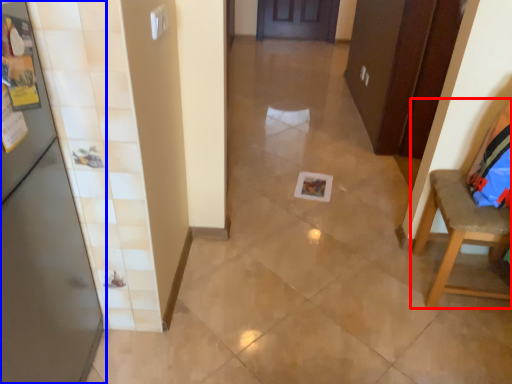
Question: Which object is closer to the camera taking this photo, chair (highlighted by a red box) or door (highlighted by a blue box)?

Choices:
 (A) chair
 (B) door

Answer: (B)